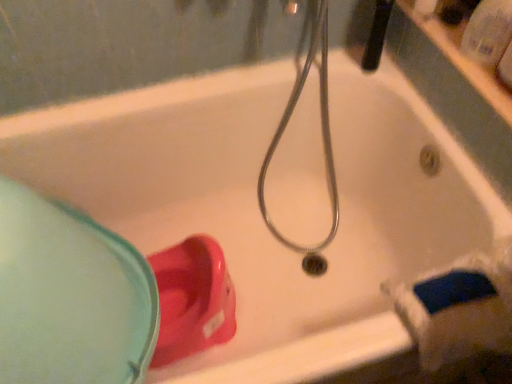
Question: From a real-world perspective, does matte plastic cup at lower left stand above transparent plastic bottle at upper right?

Choices:
 (A) yes
 (B) no

Answer: (B)

Question: Can we say matte plastic cup at lower left lies outside transparent plastic bottle at upper right?

Choices:
 (A) no
 (B) yes

Answer: (B)

Question: Does matte plastic cup at lower left have a lesser width compared to transparent plastic bottle at upper right?

Choices:
 (A) no
 (B) yes

Answer: (A)

Question: Can you confirm if matte plastic cup at lower left is positioned to the right of transparent plastic bottle at upper right?

Choices:
 (A) no
 (B) yes

Answer: (A)

Question: Considering the relative positions of matte plastic cup at lower left and transparent plastic bottle at upper right in the image provided, is matte plastic cup at lower left behind transparent plastic bottle at upper right?

Choices:
 (A) no
 (B) yes

Answer: (A)

Question: Can you confirm if matte plastic cup at lower left is wider than transparent plastic bottle at upper right?

Choices:
 (A) no
 (B) yes

Answer: (B)

Question: Considering the relative positions of matte plastic cup at lower left and black rubber showerhead at upper center in the image provided, is matte plastic cup at lower left behind black rubber showerhead at upper center?

Choices:
 (A) yes
 (B) no

Answer: (B)

Question: Does matte plastic cup at lower left turn towards black rubber showerhead at upper center?

Choices:
 (A) no
 (B) yes

Answer: (A)

Question: Considering the relative sizes of matte plastic cup at lower left and black rubber showerhead at upper center in the image provided, is matte plastic cup at lower left wider than black rubber showerhead at upper center?

Choices:
 (A) no
 (B) yes

Answer: (B)

Question: Does matte plastic cup at lower left appear on the right side of black rubber showerhead at upper center?

Choices:
 (A) yes
 (B) no

Answer: (B)

Question: Is matte plastic cup at lower left outside of black rubber showerhead at upper center?

Choices:
 (A) no
 (B) yes

Answer: (B)

Question: Considering the relative sizes of matte plastic cup at lower left and black rubber showerhead at upper center in the image provided, is matte plastic cup at lower left thinner than black rubber showerhead at upper center?

Choices:
 (A) no
 (B) yes

Answer: (A)

Question: Is black rubber showerhead at upper center beside matte plastic cup at lower left?

Choices:
 (A) yes
 (B) no

Answer: (B)